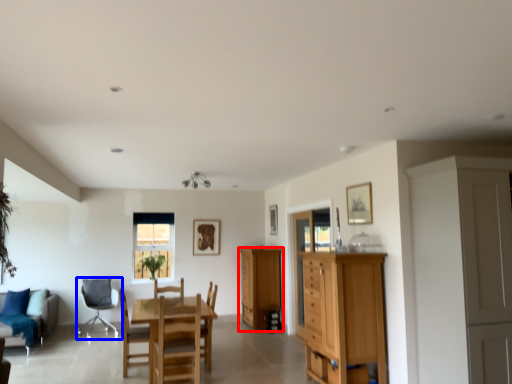
Question: Which object appears closest to the camera in this image, cabinetry (highlighted by a red box) or chair (highlighted by a blue box)?

Choices:
 (A) cabinetry
 (B) chair

Answer: (B)